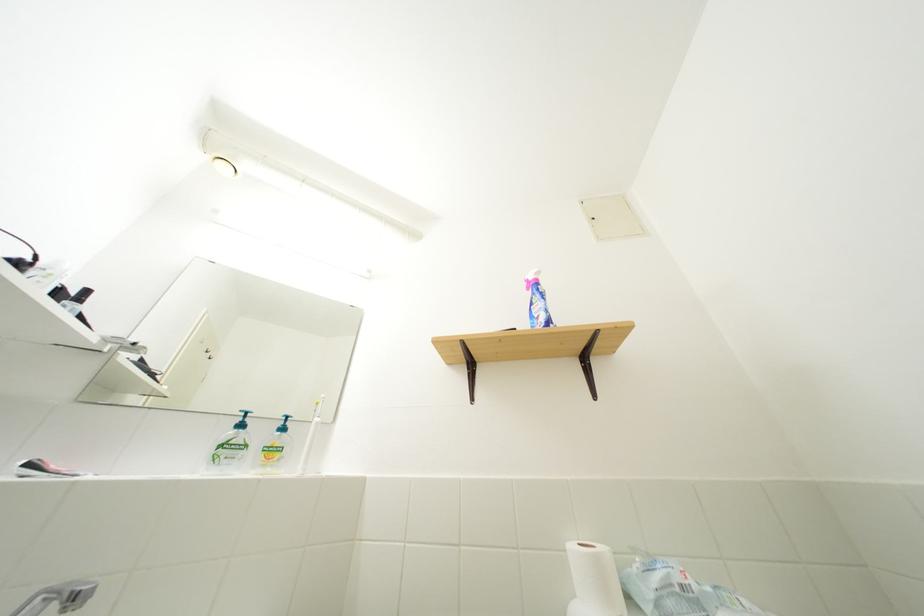
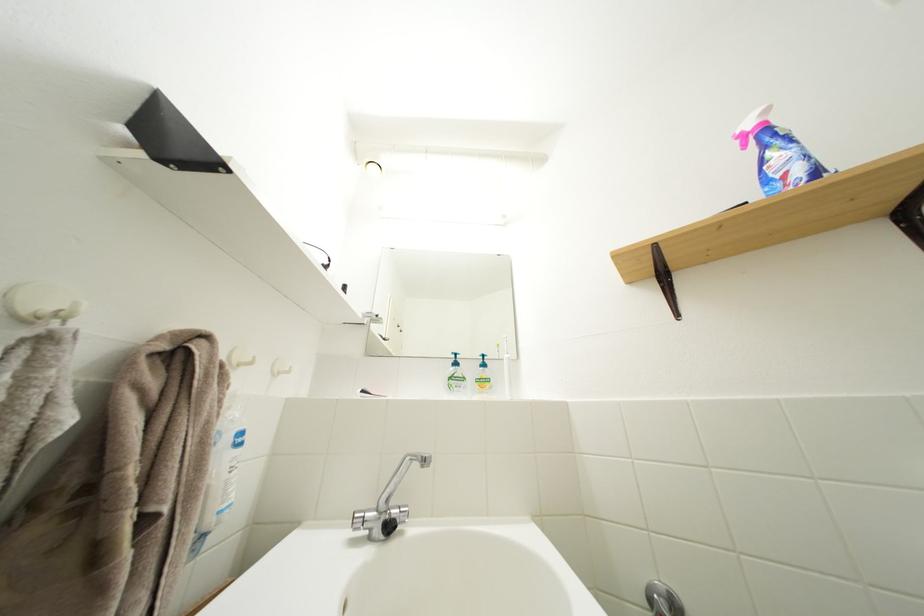
Where in the second image is the point corresponding to (229,452) from the first image?

(458, 384)